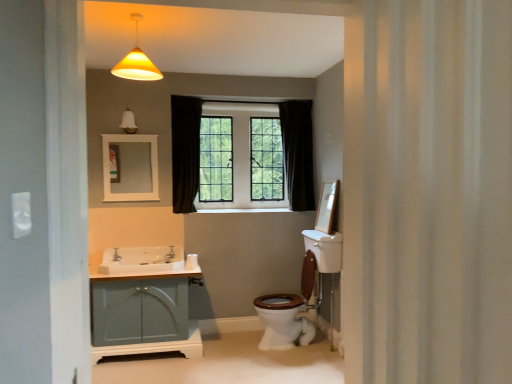
Question: Looking at the image, does white glossy sink at lower left seem bigger or smaller compared to white matte mirror at upper center?

Choices:
 (A) small
 (B) big

Answer: (B)

Question: Considering the positions of white glossy sink at lower left and white matte mirror at upper center in the image, is white glossy sink at lower left wider or thinner than white matte mirror at upper center?

Choices:
 (A) wide
 (B) thin

Answer: (A)

Question: Considering the real-world distances, which object is closest to the white textured shower curtain at right?

Choices:
 (A) white matte mirror at upper center
 (B) matte teal cabinet at lower left
 (C) brushed metal faucet at sink left, arranged as the 1th faucet when viewed from the back
 (D) matte glass bell at upper center
 (E) white glossy sink at lower left

Answer: (B)

Question: Estimate the real-world distances between objects in this image. Which object is farther from the matte teal cabinet at lower left?

Choices:
 (A) black glass window at center
 (B) white matte toilet paper at lower center
 (C) brushed metal faucet at sink left, marked as the second faucet in a left-to-right arrangement
 (D) white textured shower curtain at right
 (E) matte silver faucet at sink left, the 1th faucet in the front-to-back sequence

Answer: (D)